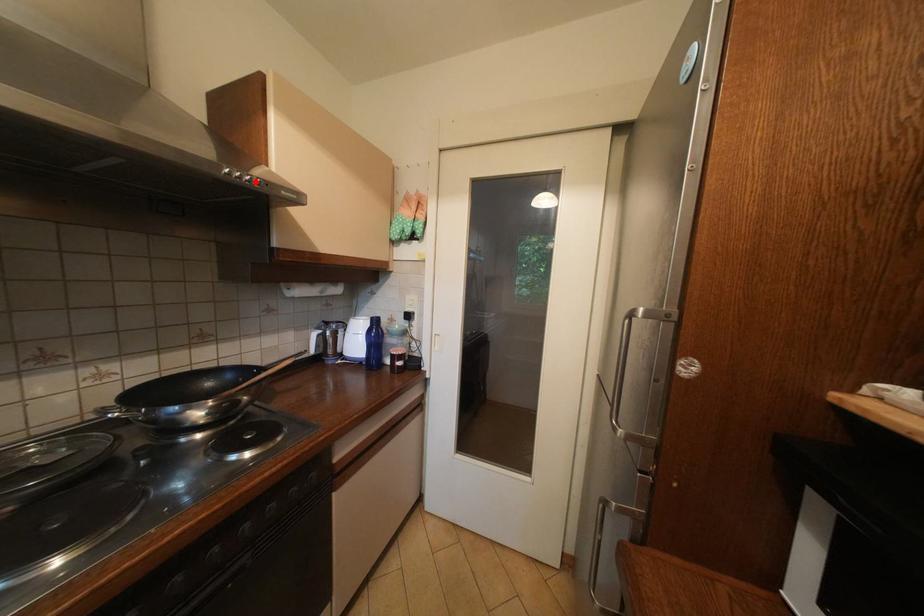
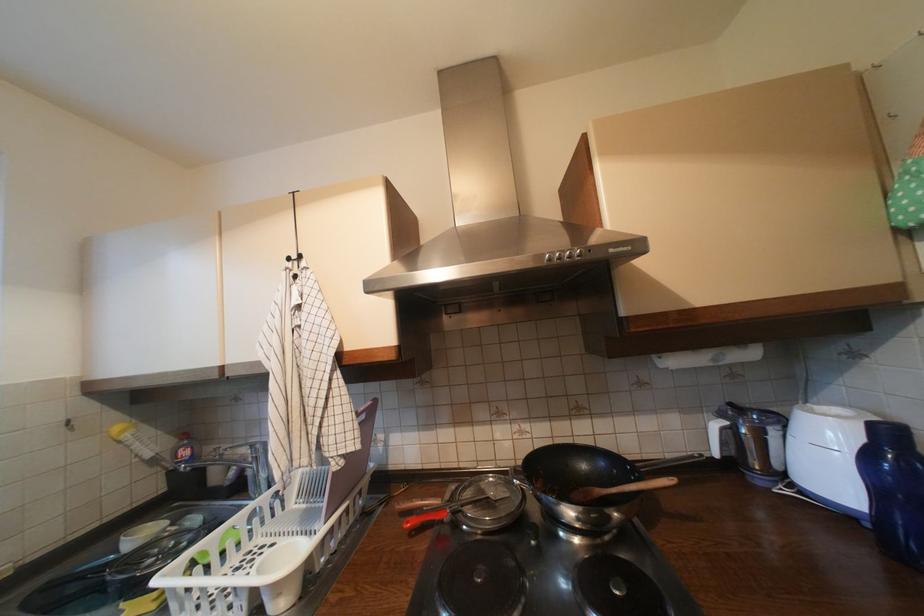
In the second image, find the point that corresponds to the highlighted location in the first image.

(577, 257)